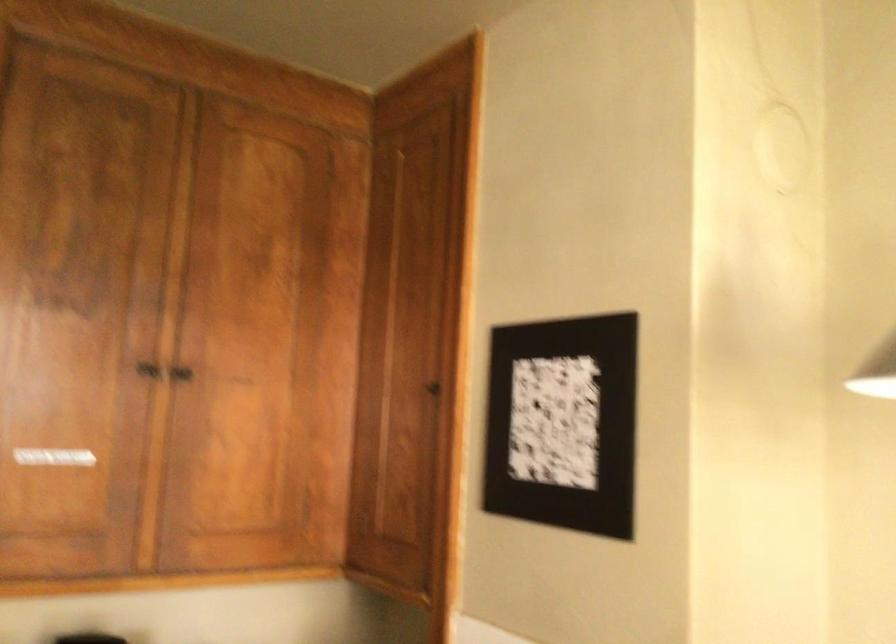
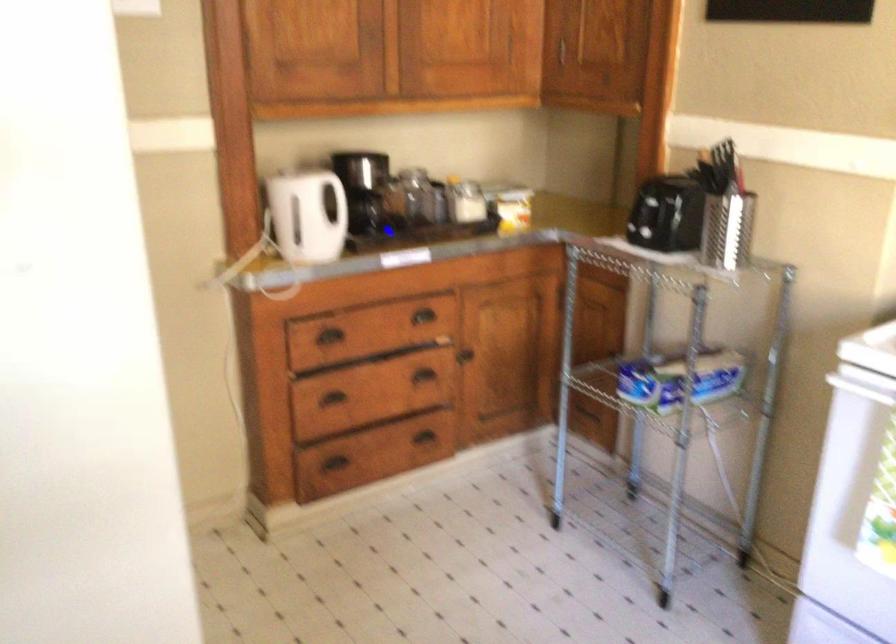
Question: How did the camera likely rotate?

Choices:
 (A) Left
 (B) Right
 (C) Up
 (D) Down

Answer: (D)